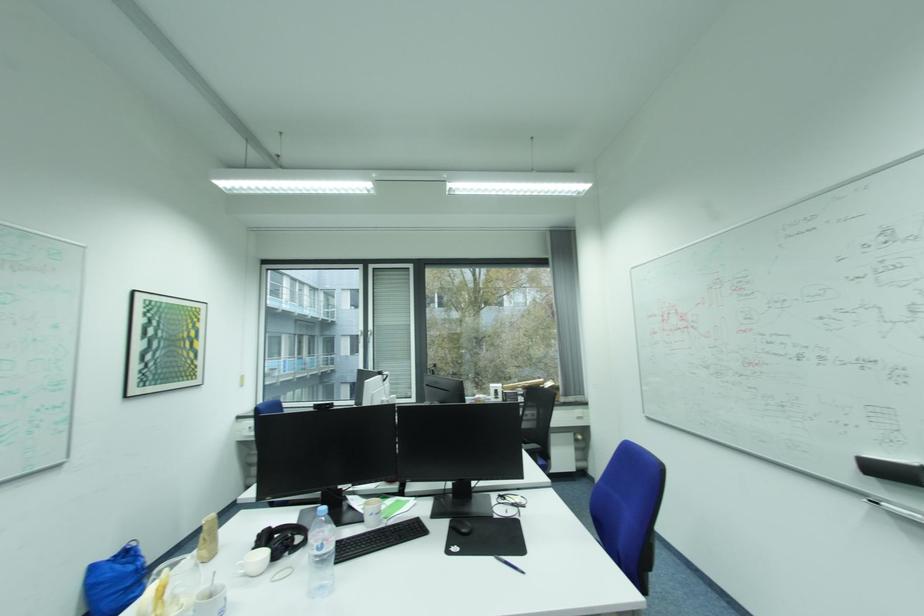
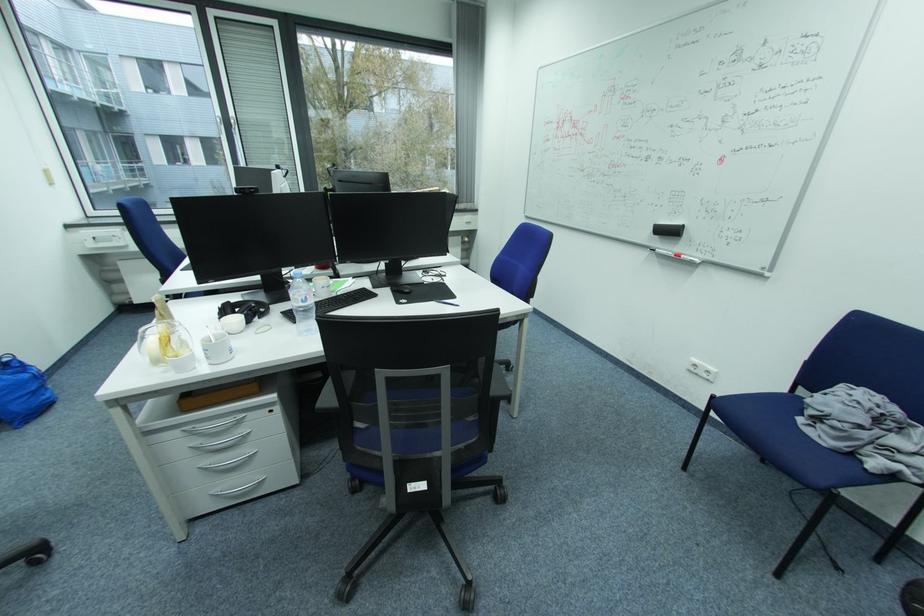
The point at (287, 546) is marked in the first image. Where is the corresponding point in the second image?

(259, 313)